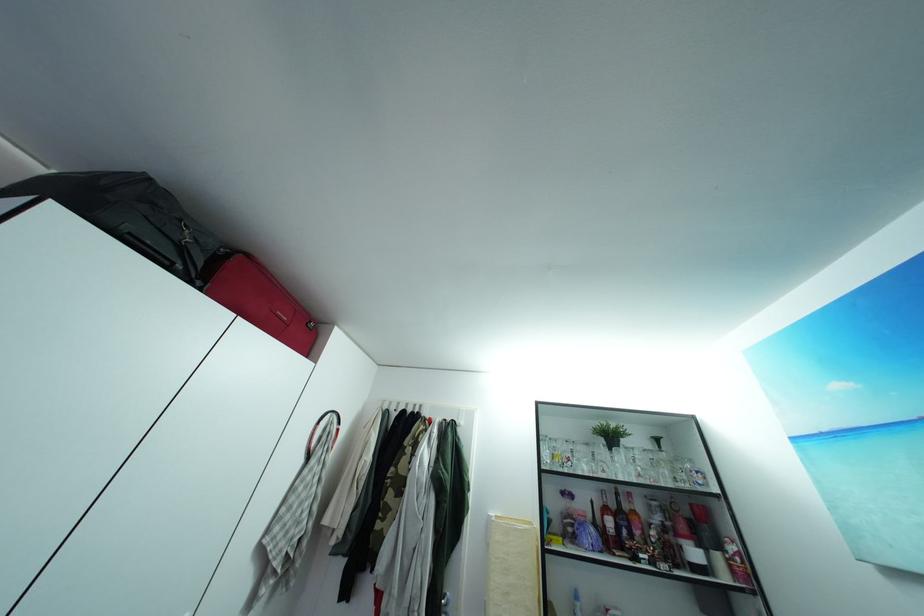
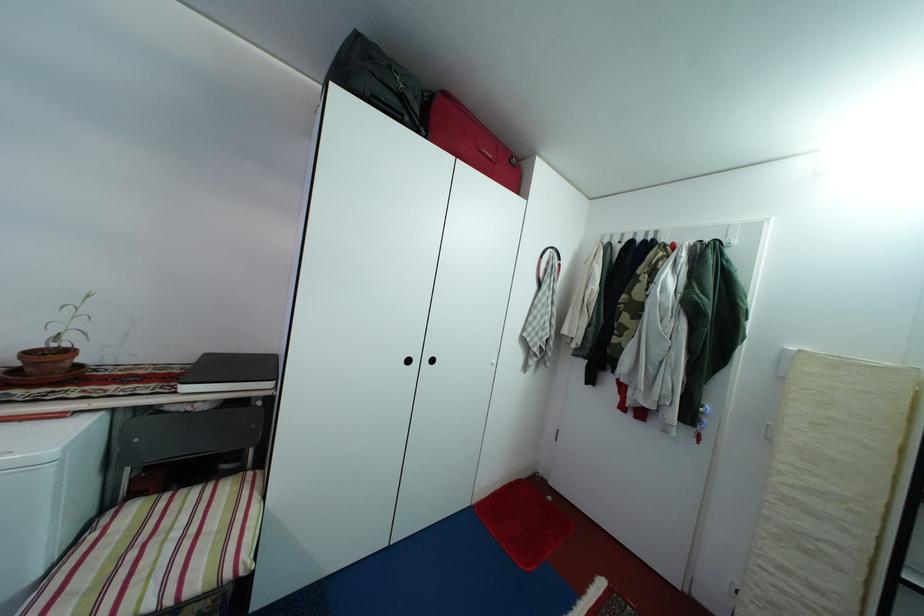
Locate, in the second image, the point that corresponds to pixel 181 270 in the first image.

(410, 123)